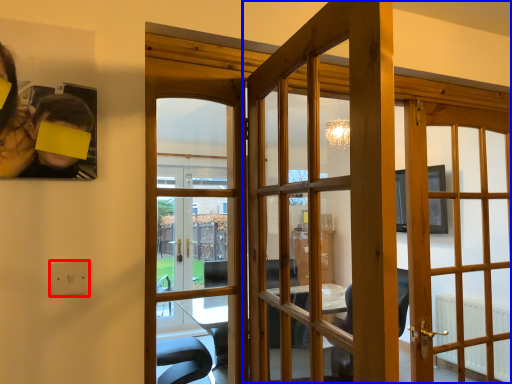
Question: Among these objects, which one is nearest to the camera, electric outlet (highlighted by a red box) or door (highlighted by a blue box)?

Choices:
 (A) electric outlet
 (B) door

Answer: (B)